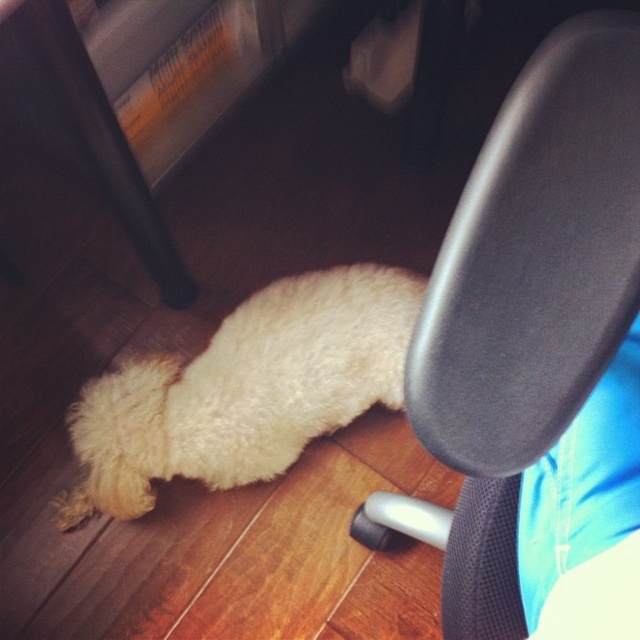
Measure the distance between black mesh chair at center and camera.

black mesh chair at center is 31.26 centimeters away from camera.

Is black mesh chair at center bigger than white fluffy dog at lower left?

No.

Image resolution: width=640 pixels, height=640 pixels. Identify the location of black mesh chair at center. (538, 356).

At what (x,y) coordinates should I click in order to perform the action: click on black mesh chair at center. Please return your answer as a coordinate pair (x, y). This screenshot has width=640, height=640. Looking at the image, I should click on (538, 356).